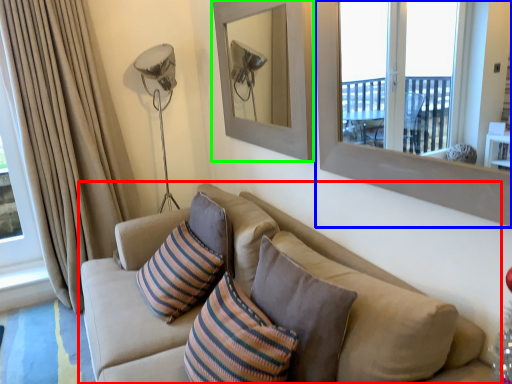
Question: Which object is the farthest from studio couch (highlighted by a red box)? Choose among these: window frame (highlighted by a blue box) or picture frame (highlighted by a green box).

Choices:
 (A) window frame
 (B) picture frame

Answer: (B)